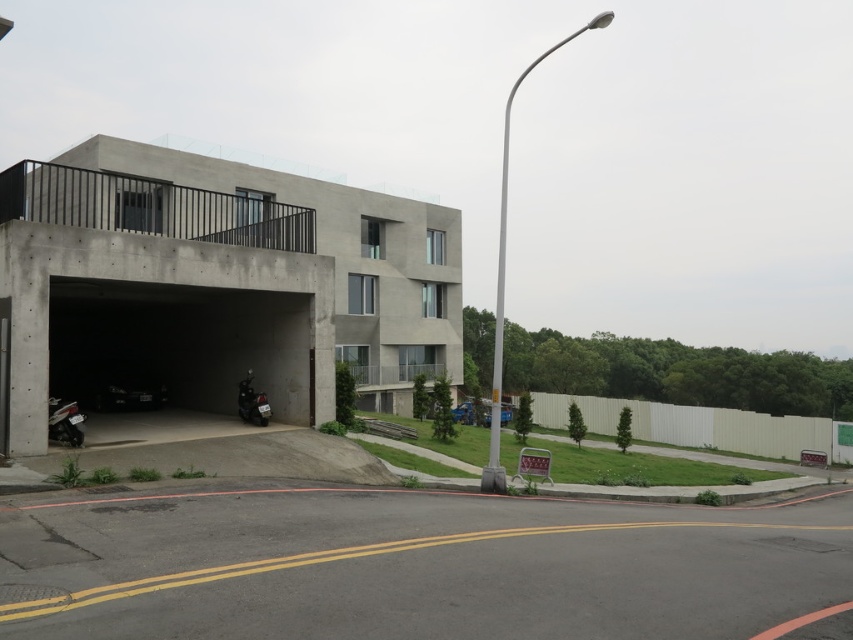
Is point (51, 397) closer to viewer compared to point (254, 422)?

That is True.

Is shiny black motorcycle at lower left taller than shiny black motorcycle at center-left?

No, shiny black motorcycle at lower left is not taller than shiny black motorcycle at center-left.

Which is behind, point (79, 428) or point (242, 404)?

The point (242, 404) is more distant.

This screenshot has width=853, height=640. Find the location of `shiny black motorcycle at lower left`. shiny black motorcycle at lower left is located at coordinates (65, 420).

Between concrete parking garage at left and shiny black motorcycle at lower left, which one has more height?

Standing taller between the two is concrete parking garage at left.

Measure the distance between concrete parking garage at left and shiny black motorcycle at lower left.

concrete parking garage at left is 15.89 meters from shiny black motorcycle at lower left.

Which is behind, point (57, 252) or point (71, 422)?

The point (71, 422) is behind.

At what (x,y) coordinates should I click in order to perform the action: click on concrete parking garage at left. Please return your answer as a coordinate pair (x, y). The height and width of the screenshot is (640, 853). Looking at the image, I should click on (218, 282).

Which is in front, point (209, 225) or point (251, 371)?

Point (251, 371) is more forward.

Can you confirm if concrete parking garage at left is positioned above shiny black motorcycle at center-left?

Correct, concrete parking garage at left is located above shiny black motorcycle at center-left.

Between point (274, 289) and point (248, 394), which one is positioned behind?

Point (248, 394)

Where is `concrete parking garage at left`? This screenshot has width=853, height=640. concrete parking garage at left is located at coordinates (218, 282).